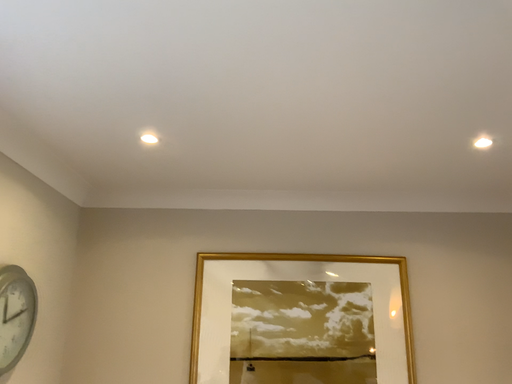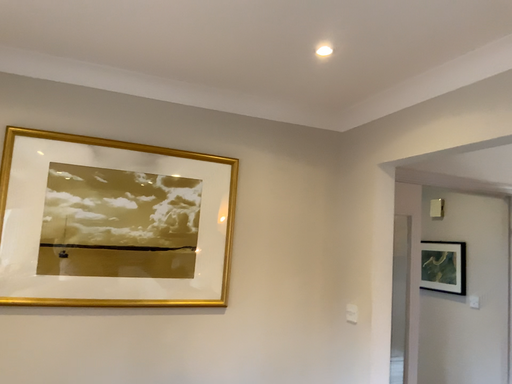
Question: How did the camera likely rotate when shooting the video?

Choices:
 (A) rotated upward
 (B) rotated downward

Answer: (B)